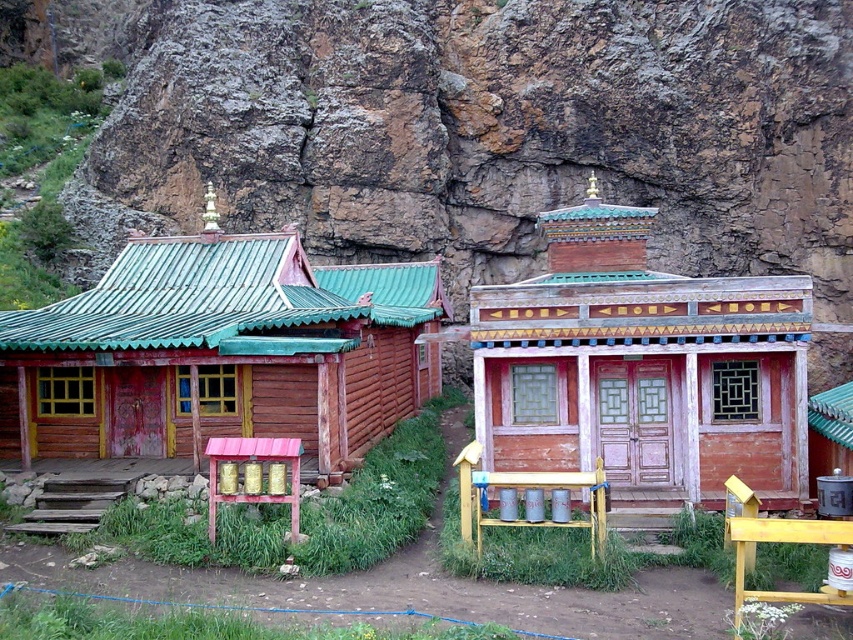
Between wooden cabin at left and wooden cabin at center, which one has less height?

With less height is wooden cabin at left.

Does wooden cabin at left have a greater height compared to wooden cabin at center?

No.

Does point (15, 433) come closer to viewer compared to point (634, 264)?

Yes.

Where is `wooden cabin at left`? wooden cabin at left is located at coordinates (219, 352).